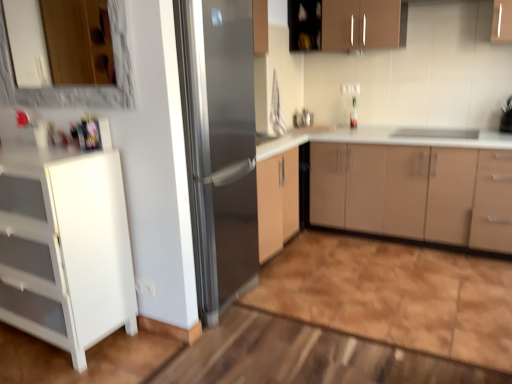
The width and height of the screenshot is (512, 384). What are the coordinates of `satin nickel faucet at upper center` in the screenshot? It's located at (306, 117).

Describe the element at coordinates (65, 247) in the screenshot. The image size is (512, 384). I see `white glossy cabinet at left, which appears as the third cabinetry when viewed from the top` at that location.

Locate an element on the screen. The width and height of the screenshot is (512, 384). stainless steel refrigerator at center is located at coordinates (219, 144).

Describe the element at coordinates (219, 144) in the screenshot. This screenshot has height=384, width=512. I see `stainless steel refrigerator at center` at that location.

At what (x,y) coordinates should I click in order to perform the action: click on matte beige cabinet at center, the first cabinetry viewed from the right. Please return your answer as a coordinate pair (x, y). Looking at the image, I should click on (407, 184).

Who is smaller, brown matte cabinet at upper center, arranged as the first cabinetry when viewed from the top, or stainless steel refrigerator at center?

brown matte cabinet at upper center, arranged as the first cabinetry when viewed from the top, is smaller.

Considering the relative positions of brown matte cabinet at upper center, which is counted as the second cabinetry, starting from the left, and stainless steel refrigerator at center in the image provided, is brown matte cabinet at upper center, which is counted as the second cabinetry, starting from the left, to the right of stainless steel refrigerator at center from the viewer's perspective?

Correct, you'll find brown matte cabinet at upper center, which is counted as the second cabinetry, starting from the left, to the right of stainless steel refrigerator at center.

Are brown matte cabinet at upper center, which is the 2th cabinetry from right to left, and stainless steel refrigerator at center located far from each other?

Yes, brown matte cabinet at upper center, which is the 2th cabinetry from right to left, and stainless steel refrigerator at center are located far from each other.

Is brown matte cabinet at upper center, the third cabinetry when ordered from bottom to top, looking in the opposite direction of stainless steel refrigerator at center?

No, brown matte cabinet at upper center, the third cabinetry when ordered from bottom to top,'s orientation is not away from stainless steel refrigerator at center.

Which is closer to the camera, (489, 131) or (133, 102)?

Point (489, 131).

Consider the image. Is matte beige cabinet at center, which is the second cabinetry from bottom to top, oriented towards wooden frame mirror at upper left?

No, matte beige cabinet at center, which is the second cabinetry from bottom to top, does not turn towards wooden frame mirror at upper left.

Is matte beige cabinet at center, which appears as the second cabinetry when viewed from the top, completely or partially outside of wooden frame mirror at upper left?

Indeed, matte beige cabinet at center, which appears as the second cabinetry when viewed from the top, is completely outside wooden frame mirror at upper left.

From the image's perspective, is matte beige cabinet at center, which appears as the second cabinetry when viewed from the top, above or below wooden frame mirror at upper left?

matte beige cabinet at center, which appears as the second cabinetry when viewed from the top, is situated lower than wooden frame mirror at upper left in the image.

From the image's perspective, is stainless steel refrigerator at center over white glossy cabinet at left, which ranks as the third cabinetry in right-to-left order?

Yes.

Which is more to the left, stainless steel refrigerator at center or white glossy cabinet at left, which appears as the third cabinetry when viewed from the top?

From the viewer's perspective, white glossy cabinet at left, which appears as the third cabinetry when viewed from the top, appears more on the left side.

Identify the location of refrigerator lying on the right of white glossy cabinet at left, which appears as the third cabinetry when viewed from the top. (219, 144).

Would you consider stainless steel refrigerator at center to be distant from white glossy cabinet at left, which ranks as the third cabinetry in right-to-left order?

stainless steel refrigerator at center is near white glossy cabinet at left, which ranks as the third cabinetry in right-to-left order, not far away.

Is matte beige cabinet at center, which appears as the second cabinetry when viewed from the top, turned away from white glossy cabinet at left, which is the 1th cabinetry from bottom to top?

That's not correct — matte beige cabinet at center, which appears as the second cabinetry when viewed from the top, is not looking away from white glossy cabinet at left, which is the 1th cabinetry from bottom to top.

Which point is more distant from viewer, (452, 190) or (31, 226)?

Positioned behind is point (452, 190).

Is matte beige cabinet at center, which is the second cabinetry from bottom to top, not inside white glossy cabinet at left, the 1th cabinetry from the left?

Yes, matte beige cabinet at center, which is the second cabinetry from bottom to top, is located beyond the bounds of white glossy cabinet at left, the 1th cabinetry from the left.

Can you tell me how much satin nickel faucet at upper center and stainless steel refrigerator at center differ in facing direction?

89.7 degrees.

Are satin nickel faucet at upper center and stainless steel refrigerator at center beside each other?

satin nickel faucet at upper center and stainless steel refrigerator at center are not in contact.

You are a GUI agent. You are given a task and a screenshot of the screen. Output one action in this format:
    pyautogui.click(x=<x>, y=<y>)
    Task: Click on the refrigerator below the satin nickel faucet at upper center (from a real-world perspective)
    
    Given the screenshot: What is the action you would take?
    pyautogui.click(x=219, y=144)

Considering the positions of objects matte beige cabinet at center, the third cabinetry in the left-to-right sequence, and satin nickel faucet at upper center in the image provided, who is behind, matte beige cabinet at center, the third cabinetry in the left-to-right sequence, or satin nickel faucet at upper center?

satin nickel faucet at upper center is behind.

At what (x,y) coordinates should I click in order to perform the action: click on faucet above the matte beige cabinet at center, the first cabinetry viewed from the right (from the image's perspective). Please return your answer as a coordinate pair (x, y). Image resolution: width=512 pixels, height=384 pixels. Looking at the image, I should click on (306, 117).

Which is farther, (503,195) or (309,126)?

The point (309,126) is farther from the camera.

In terms of height, does wooden frame mirror at upper left look taller or shorter compared to white glossy cabinet at left, the 1th cabinetry from the left?

Considering their sizes, wooden frame mirror at upper left has less height than white glossy cabinet at left, the 1th cabinetry from the left.

Is wooden frame mirror at upper left at the left side of white glossy cabinet at left, the 1th cabinetry from the left?

No.

Does point (1, 23) appear closer or farther from the camera than point (13, 161)?

Point (1, 23) appears to be farther away from the viewer than point (13, 161).

From a real-world perspective, relative to white glossy cabinet at left, which appears as the third cabinetry when viewed from the top, is wooden frame mirror at upper left vertically above or below?

From a real-world perspective, wooden frame mirror at upper left is physically above white glossy cabinet at left, which appears as the third cabinetry when viewed from the top.

Locate an element on the screen. The width and height of the screenshot is (512, 384). cabinetry above the stainless steel refrigerator at center (from a real-world perspective) is located at coordinates (346, 24).

I want to click on mirror in front of the matte beige cabinet at center, which is the second cabinetry from bottom to top, so click(77, 86).

Which object lies nearer to the anchor point white glossy cabinet at left, which appears as the third cabinetry when viewed from the top, stainless steel refrigerator at center or matte beige cabinet at center, the first cabinetry viewed from the right?

The object closer to white glossy cabinet at left, which appears as the third cabinetry when viewed from the top, is stainless steel refrigerator at center.

From the image, which object appears to be farther from wooden frame mirror at upper left, white glossy cabinet at left, which ranks as the third cabinetry in right-to-left order, or brown matte cabinet at upper center, the third cabinetry when ordered from bottom to top?

brown matte cabinet at upper center, the third cabinetry when ordered from bottom to top, is further to wooden frame mirror at upper left.

Estimate the real-world distances between objects in this image. Which object is further from satin nickel faucet at upper center, matte beige cabinet at center, the third cabinetry in the left-to-right sequence, or white glossy cabinet at left, which appears as the third cabinetry when viewed from the top?

white glossy cabinet at left, which appears as the third cabinetry when viewed from the top, is further to satin nickel faucet at upper center.

Which object lies nearer to the anchor point stainless steel refrigerator at center, matte beige cabinet at center, the third cabinetry in the left-to-right sequence, or white glossy cabinet at left, which ranks as the third cabinetry in right-to-left order?

white glossy cabinet at left, which ranks as the third cabinetry in right-to-left order, is closer to stainless steel refrigerator at center.

From the image, which object appears to be nearer to wooden frame mirror at upper left, matte beige cabinet at center, which is the second cabinetry from bottom to top, or stainless steel refrigerator at center?

stainless steel refrigerator at center lies closer to wooden frame mirror at upper left than the other object.

From the image, which object appears to be nearer to satin nickel faucet at upper center, brown matte cabinet at upper center, arranged as the first cabinetry when viewed from the top, or white glossy cabinet at left, the 1th cabinetry from the left?

The object closer to satin nickel faucet at upper center is brown matte cabinet at upper center, arranged as the first cabinetry when viewed from the top.

Which object lies further to the anchor point wooden frame mirror at upper left, stainless steel refrigerator at center or matte beige cabinet at center, which is the second cabinetry from bottom to top?

Among the two, matte beige cabinet at center, which is the second cabinetry from bottom to top, is located further to wooden frame mirror at upper left.

When comparing their distances from matte beige cabinet at center, which appears as the second cabinetry when viewed from the top, does brown matte cabinet at upper center, arranged as the first cabinetry when viewed from the top, or white glossy cabinet at left, which is the 1th cabinetry from bottom to top, seem further?

white glossy cabinet at left, which is the 1th cabinetry from bottom to top, is positioned further to the anchor matte beige cabinet at center, which appears as the second cabinetry when viewed from the top.

Find the location of a particular element. Image resolution: width=512 pixels, height=384 pixels. refrigerator located between wooden frame mirror at upper left and satin nickel faucet at upper center in the depth direction is located at coordinates (219, 144).

What are the coordinates of `refrigerator between wooden frame mirror at upper left and white glossy cabinet at left, which ranks as the third cabinetry in right-to-left order, vertically` in the screenshot? It's located at (219, 144).

Locate an element on the screen. Image resolution: width=512 pixels, height=384 pixels. cabinetry situated between stainless steel refrigerator at center and matte beige cabinet at center, which is the second cabinetry from bottom to top, from left to right is located at coordinates (346, 24).

Locate an element on the screen. Image resolution: width=512 pixels, height=384 pixels. faucet located between wooden frame mirror at upper left and brown matte cabinet at upper center, which is the 2th cabinetry from right to left, in the left-right direction is located at coordinates (306, 117).